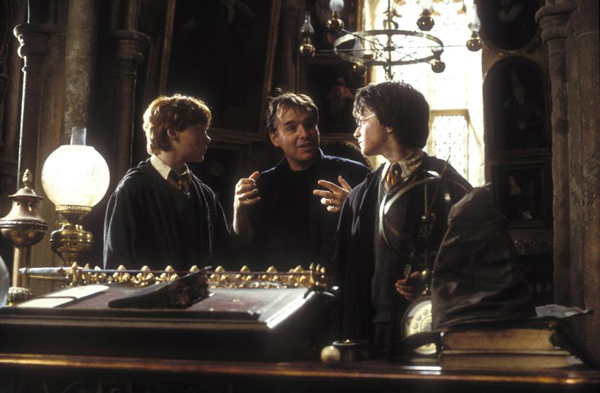
The width and height of the screenshot is (600, 393). Identify the location of dark curtains. (271, 31).